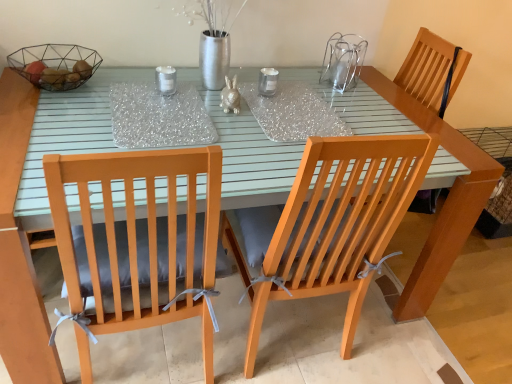
Question: Should I look upward or downward to see wooden chair with ribbons at center, placed as the 2th chair when sorted from left to right?

Choices:
 (A) up
 (B) down

Answer: (B)

Question: Is wooden chair with ribbons at center, marked as the first chair in a right-to-left arrangement, turned away from metallic wire basket at upper left?

Choices:
 (A) yes
 (B) no

Answer: (B)

Question: Is wooden chair with ribbons at center, marked as the first chair in a right-to-left arrangement, positioned in front of metallic wire basket at upper left?

Choices:
 (A) no
 (B) yes

Answer: (B)

Question: Considering the relative positions of wooden chair with ribbons at center, marked as the first chair in a right-to-left arrangement, and metallic wire basket at upper left in the image provided, is wooden chair with ribbons at center, marked as the first chair in a right-to-left arrangement, to the left of metallic wire basket at upper left from the viewer's perspective?

Choices:
 (A) yes
 (B) no

Answer: (B)

Question: From the image's perspective, would you say wooden chair with ribbons at center, marked as the first chair in a right-to-left arrangement, is shown under metallic wire basket at upper left?

Choices:
 (A) yes
 (B) no

Answer: (A)

Question: Is wooden chair with ribbons at center, marked as the first chair in a right-to-left arrangement, bigger than metallic wire basket at upper left?

Choices:
 (A) yes
 (B) no

Answer: (A)

Question: Is wooden chair with ribbons at center, marked as the first chair in a right-to-left arrangement, wider than matte gray cushion at left, marked as the first chair in a left-to-right arrangement?

Choices:
 (A) yes
 (B) no

Answer: (A)

Question: Is wooden chair with ribbons at center, placed as the 2th chair when sorted from left to right, taller than matte gray cushion at left, marked as the first chair in a left-to-right arrangement?

Choices:
 (A) no
 (B) yes

Answer: (B)

Question: Could matte gray cushion at left, which appears as the 2th chair when viewed from the right, be considered to be inside wooden chair with ribbons at center, placed as the 2th chair when sorted from left to right?

Choices:
 (A) yes
 (B) no

Answer: (B)

Question: Does wooden chair with ribbons at center, placed as the 2th chair when sorted from left to right, come in front of matte gray cushion at left, marked as the first chair in a left-to-right arrangement?

Choices:
 (A) no
 (B) yes

Answer: (B)

Question: Does wooden chair with ribbons at center, marked as the first chair in a right-to-left arrangement, have a lesser height compared to matte gray cushion at left, marked as the first chair in a left-to-right arrangement?

Choices:
 (A) yes
 (B) no

Answer: (B)

Question: Can you confirm if wooden chair with ribbons at center, marked as the first chair in a right-to-left arrangement, is thinner than matte gray cushion at left, marked as the first chair in a left-to-right arrangement?

Choices:
 (A) yes
 (B) no

Answer: (B)

Question: Is matte gray cushion at left, marked as the first chair in a left-to-right arrangement, not within wooden chair at right?

Choices:
 (A) no
 (B) yes

Answer: (B)